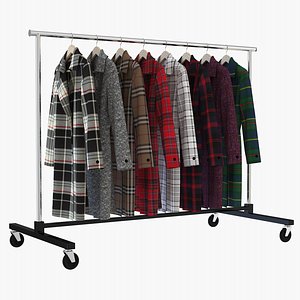
In order to click on jackets on a rack in this screenshot , I will do `click(76, 65)`, `click(97, 69)`, `click(129, 82)`, `click(150, 79)`, `click(170, 83)`, `click(182, 88)`, `click(210, 93)`, `click(224, 91)`, `click(241, 94)`.